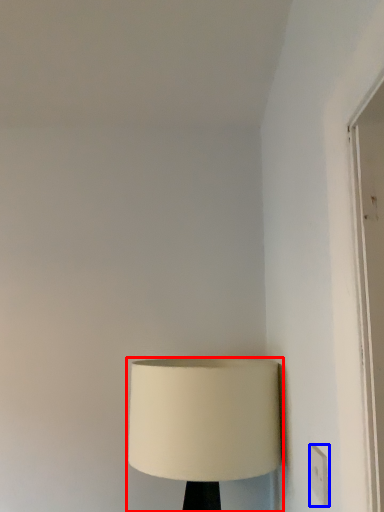
Question: Which object appears closest to the camera in this image, lamp (highlighted by a red box) or electric outlet (highlighted by a blue box)?

Choices:
 (A) lamp
 (B) electric outlet

Answer: (B)